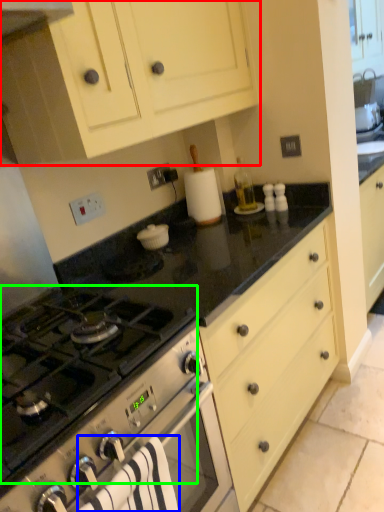
Question: Based on their relative distances, which object is farther from cabinetry (highlighted by a red box)? Choose from bath towel (highlighted by a blue box) and gas stove (highlighted by a green box).

Choices:
 (A) bath towel
 (B) gas stove

Answer: (A)